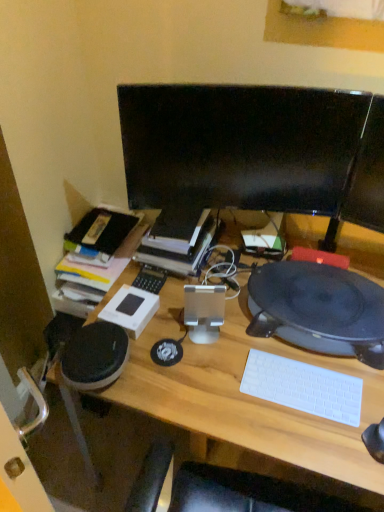
Question: Is black matte record player at right in front of or behind white plastic keyboard at lower right in the image?

Choices:
 (A) front
 (B) behind

Answer: (B)

Question: Is point (276, 284) positioned closer to the camera than point (357, 396)?

Choices:
 (A) farther
 (B) closer

Answer: (A)

Question: Considering the real-world distances, which object is closest to the black matte record player at right?

Choices:
 (A) black glossy monitor at center
 (B) hardcover book at center
 (C) white plastic keyboard at lower right
 (D) wooden desk at center

Answer: (C)

Question: Which is farther from the black glossy monitor at center?

Choices:
 (A) wooden desk at center
 (B) black matte record player at right
 (C) hardcover book at center
 (D) white plastic keyboard at lower right

Answer: (D)